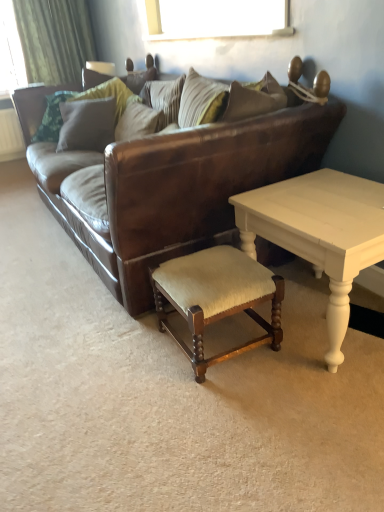
You are a GUI agent. You are given a task and a screenshot of the screen. Output one action in this format:
    pyautogui.click(x=<x>, y=<y>)
    Task: Click on the free space in front of wooden upholstered stool at lower center
    
    Given the screenshot: What is the action you would take?
    pyautogui.click(x=223, y=406)